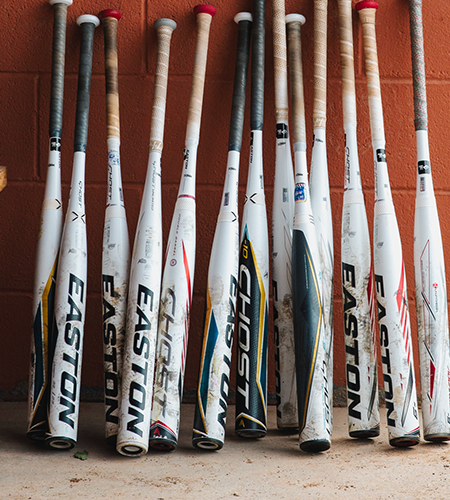
This screenshot has width=450, height=500. Identify the location of floor. (290, 489).